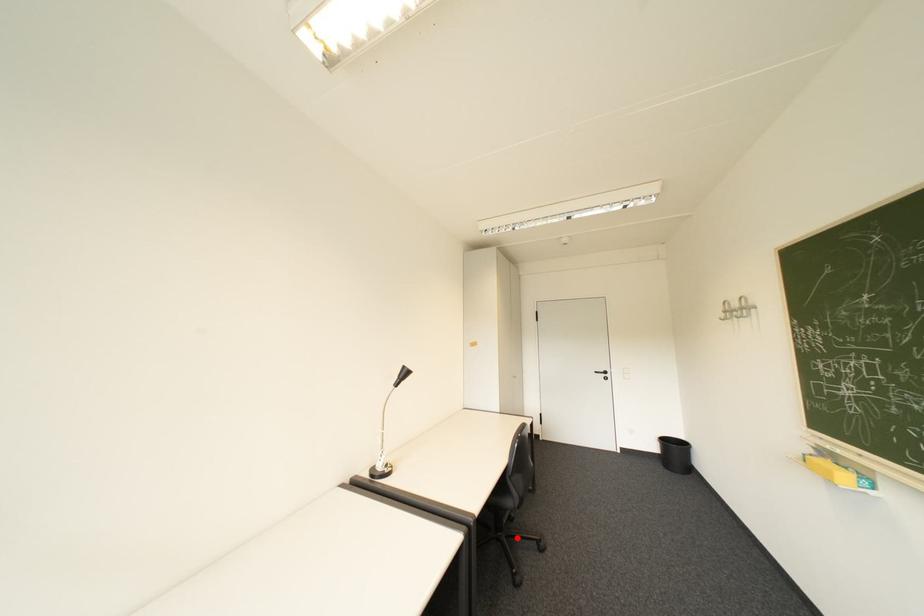
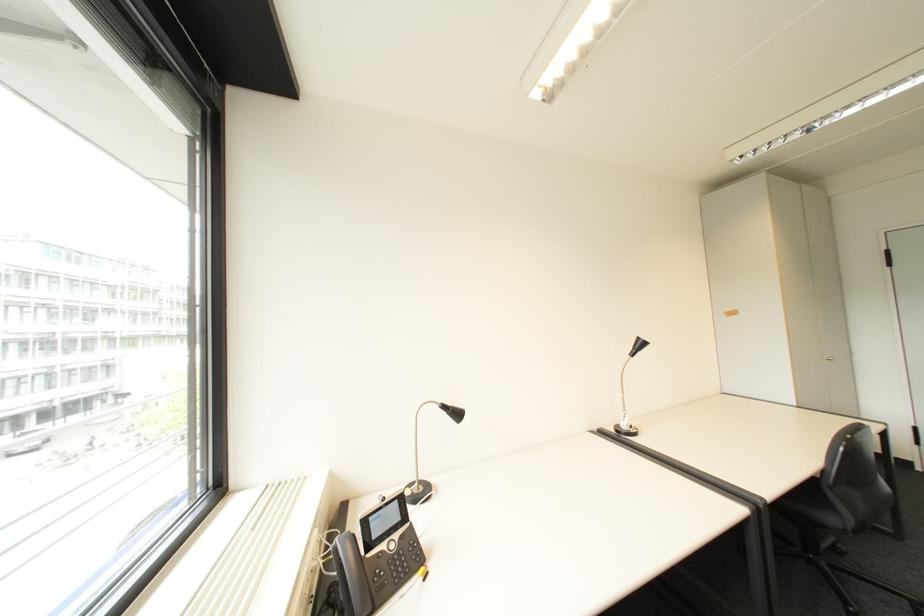
Question: I am providing you with two images of the same scene from different viewpoints. In image1, a red point is highlighted. Considering the same 3D point in image2, which of the following is correct?

Choices:
 (A) It is closer
 (B) It is farther

Answer: (A)